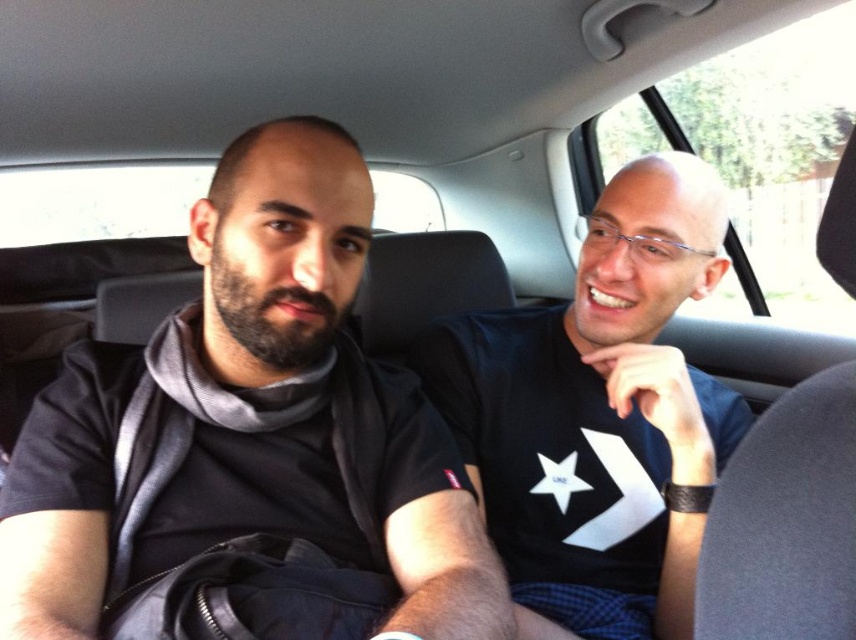
You are a passenger in the car and want to check if your blue fabric shirt at center is touching the black leather seat at center. Based on their positions, can you determine if they are in contact?

The blue fabric shirt at center is located above the black leather seat at center, so they are in contact.

You are a passenger in the car and want to hand a document to the driver. The document is currently on the seat next to the blue fabric shirt at center. Is the document closer to the driver or the passenger?

The document is closer to the passenger because the blue fabric shirt at center is positioned at point (x=599, y=416), which is closer to the passenger side of the car.